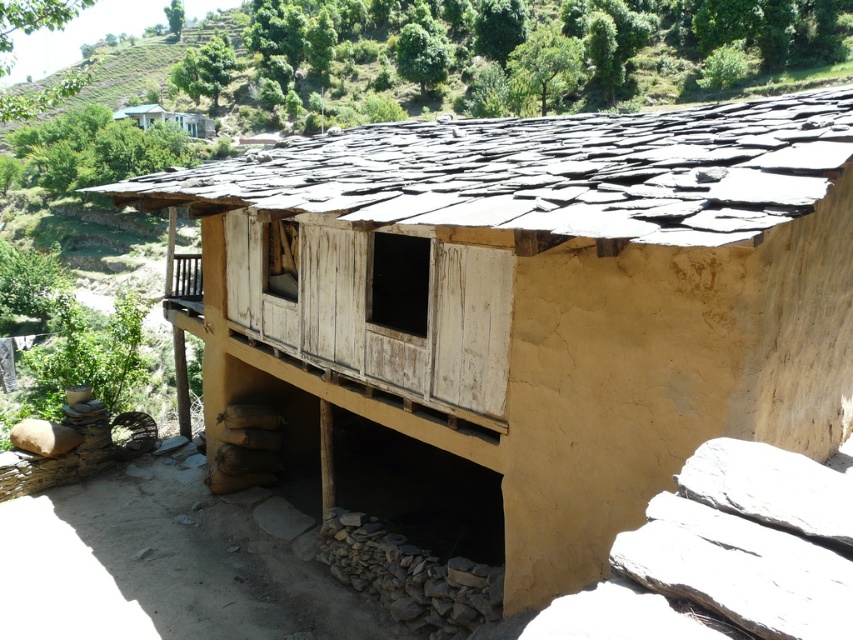
In the scene shown: Does dark gray slate roof at upper center appear under light blue wooden house at upper left?

Yes, dark gray slate roof at upper center is below light blue wooden house at upper left.

Between dark gray slate roof at upper center and light blue wooden house at upper left, which one has more height?

dark gray slate roof at upper center

The width and height of the screenshot is (853, 640). Describe the element at coordinates (544, 172) in the screenshot. I see `dark gray slate roof at upper center` at that location.

Image resolution: width=853 pixels, height=640 pixels. What are the coordinates of `dark gray slate roof at upper center` in the screenshot? It's located at (544, 172).